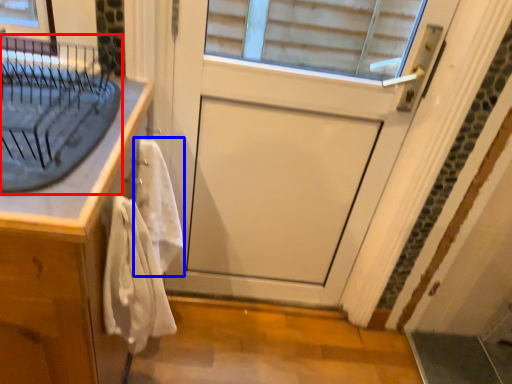
Question: Among these objects, which one is farthest to the camera, sink (highlighted by a red box) or bath towel (highlighted by a blue box)?

Choices:
 (A) sink
 (B) bath towel

Answer: (B)